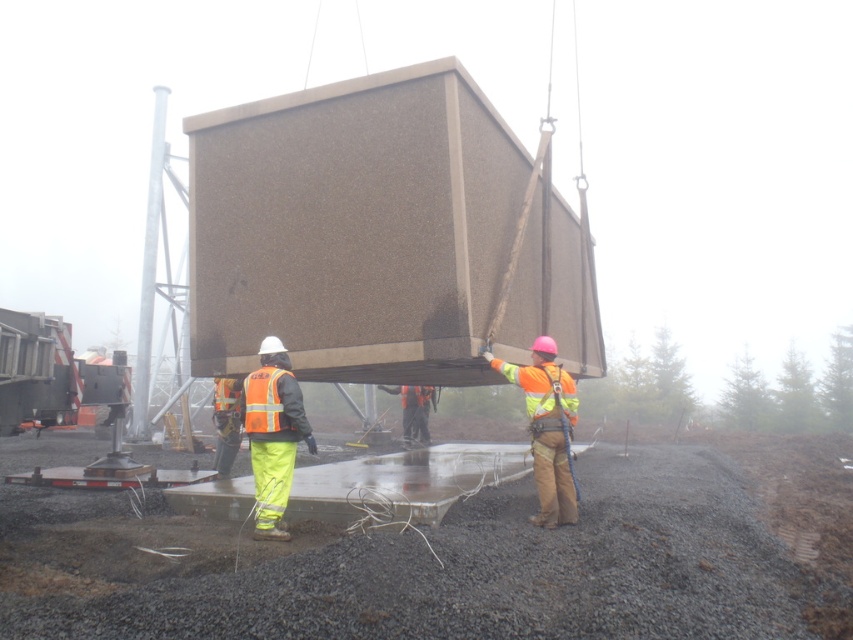
Does black gravel at lower center appear under hi-visibility reflective vest at center?

Indeed, black gravel at lower center is positioned under hi-visibility reflective vest at center.

At what (x,y) coordinates should I click in order to perform the action: click on black gravel at lower center. Please return your answer as a coordinate pair (x, y). The height and width of the screenshot is (640, 853). Looking at the image, I should click on (457, 561).

At what (x,y) coordinates should I click in order to perform the action: click on black gravel at lower center. Please return your answer as a coordinate pair (x, y). Looking at the image, I should click on (457, 561).

Between hi-visibility reflective vest at center and reflective yellow safety vest at center, which one has less height?

With less height is reflective yellow safety vest at center.

Can you confirm if hi-visibility reflective vest at center is positioned to the left of reflective yellow safety vest at center?

Yes, hi-visibility reflective vest at center is to the left of reflective yellow safety vest at center.

In order to click on hi-visibility reflective vest at center in this screenshot , I will do `click(547, 428)`.

This screenshot has height=640, width=853. I want to click on hi-visibility reflective vest at center, so click(x=547, y=428).

Does hi-visibility reflective jacket at center appear on the right side of orange reflective safety vest at center?

Correct, you'll find hi-visibility reflective jacket at center to the right of orange reflective safety vest at center.

Can you confirm if hi-visibility reflective jacket at center is thinner than orange reflective safety vest at center?

No.

Is point (274, 401) farther from camera compared to point (277, 371)?

No, it is in front of (277, 371).

The image size is (853, 640). In order to click on hi-visibility reflective jacket at center in this screenshot , I will do `click(273, 435)`.